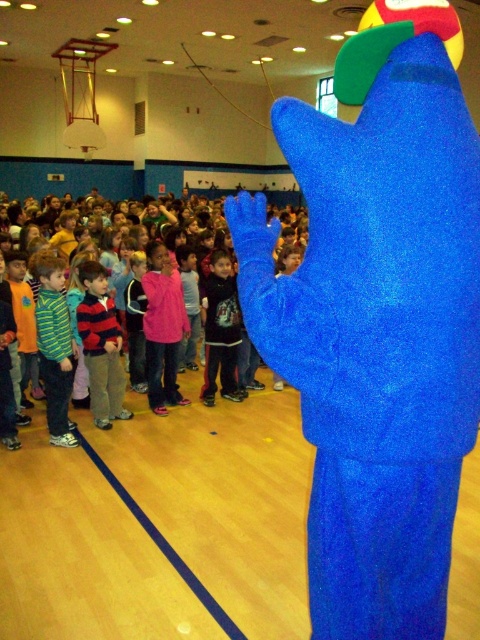
Question: Can you confirm if striped sweater at center is smaller than dark blue fleece jacket at center?

Choices:
 (A) yes
 (B) no

Answer: (A)

Question: Does striped sweater at center appear under dark blue fleece jacket at center?

Choices:
 (A) yes
 (B) no

Answer: (A)

Question: Can you confirm if striped sweater at center is positioned to the right of dark blue fleece jacket at center?

Choices:
 (A) no
 (B) yes

Answer: (A)

Question: Which point is closer to the camera taking this photo?

Choices:
 (A) coord(100,385)
 (B) coord(206,324)

Answer: (A)

Question: Which point is closer to the camera taking this photo?

Choices:
 (A) (211, 356)
 (B) (82, 264)

Answer: (B)